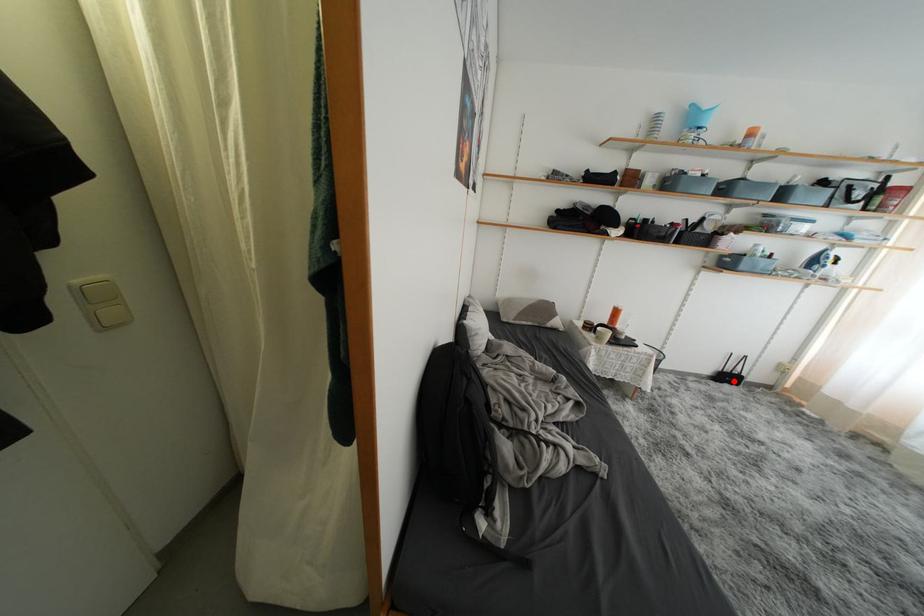
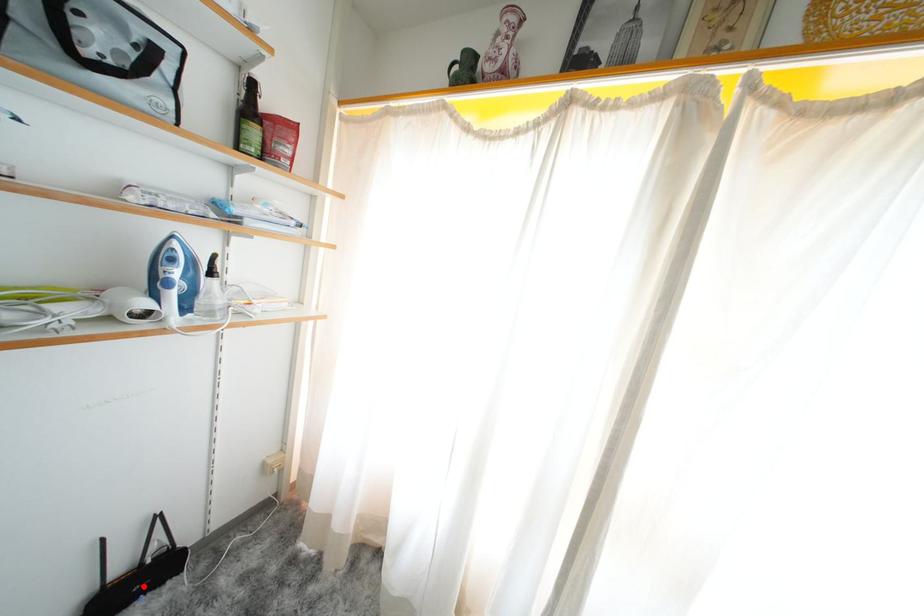
I am providing you with two images of the same scene from different viewpoints. A red point is marked on the first image and another point is marked on the second image. Do the highlighted points in image1 and image2 indicate the same real-world spot?

Yes